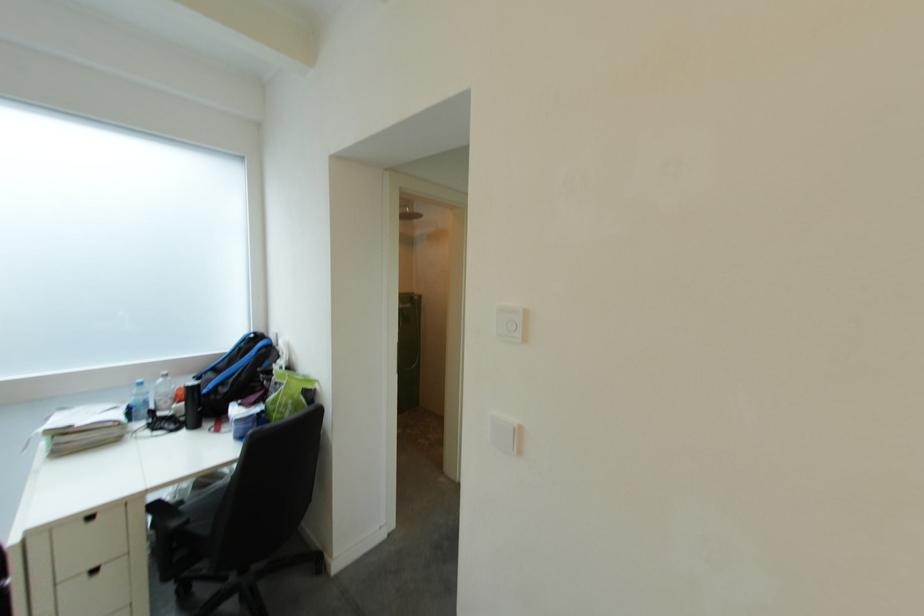
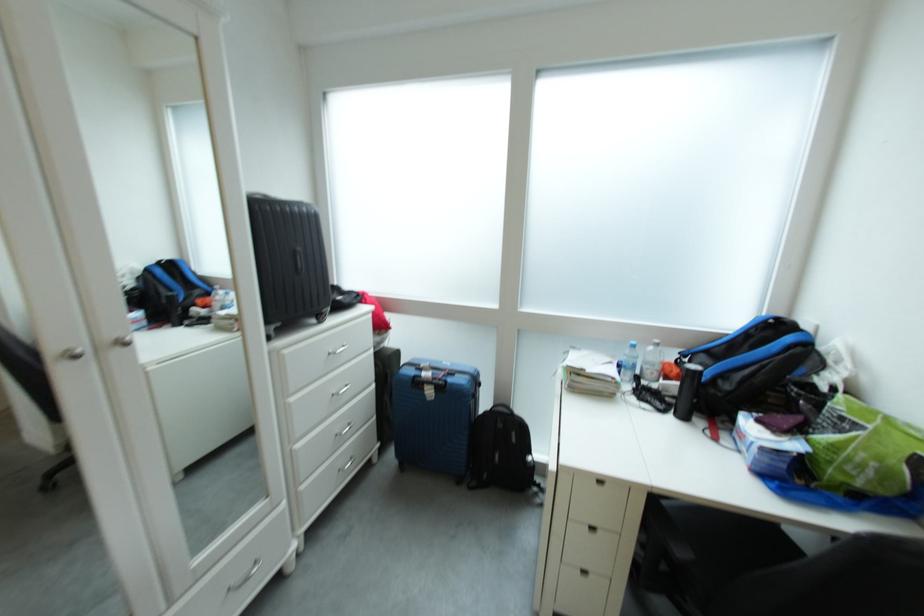
Locate, in the second image, the point that corresponds to point (120, 428) in the first image.

(622, 383)